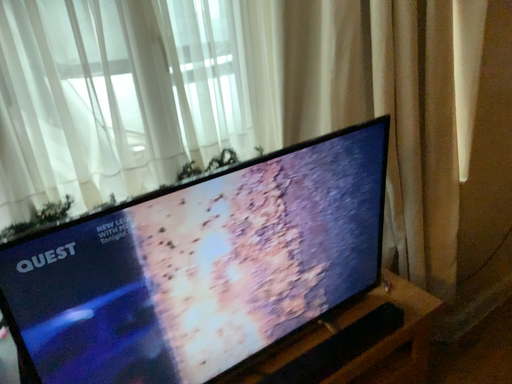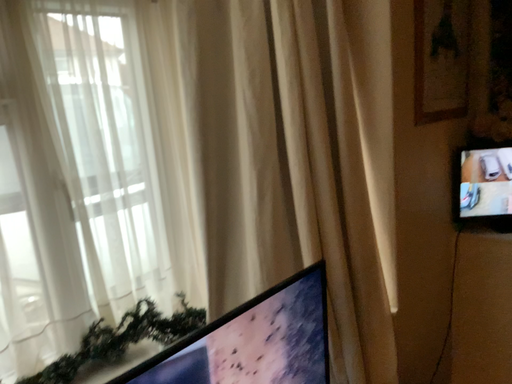
Question: Which way did the camera rotate in the video?

Choices:
 (A) rotated right
 (B) rotated left

Answer: (A)